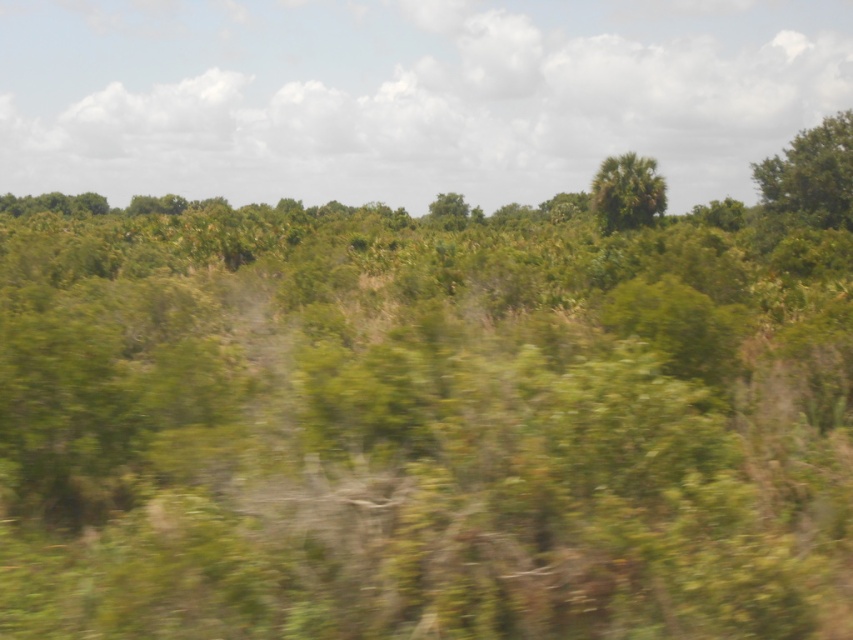
You are standing in the middle of a dense forest. You see a point marked at coordinates (627, 192). What object is located at that point?

The point at coordinates (627, 192) marks the green leafy palm at upper center.

You are an environmental scientist studying tree growth patterns in this area. You observe the green leafy tree at upper right and the green leafy tree at center. Which tree would you expect to cast a larger shadow during midday, assuming the sun is directly overhead?

The green leafy tree at upper right might cast a larger shadow than the green leafy tree at center because it is wider, as stated in the description.

You are a hiker navigating through the dense vegetation in the image. You spot a green leafy tree at upper right. Can you determine its location relative to the point marked at coordinates (811, 173)?

The green leafy tree at upper right is located exactly at the point marked at coordinates (811, 173).